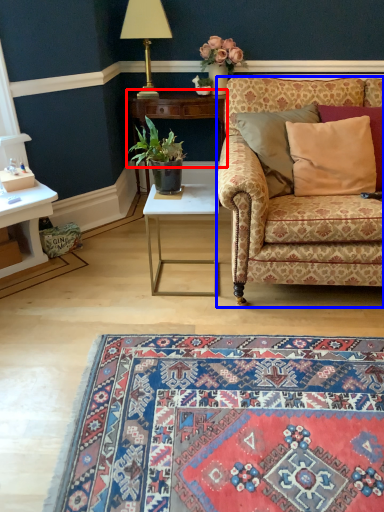
Question: Which object is closer to the camera taking this photo, table (highlighted by a red box) or studio couch (highlighted by a blue box)?

Choices:
 (A) table
 (B) studio couch

Answer: (B)